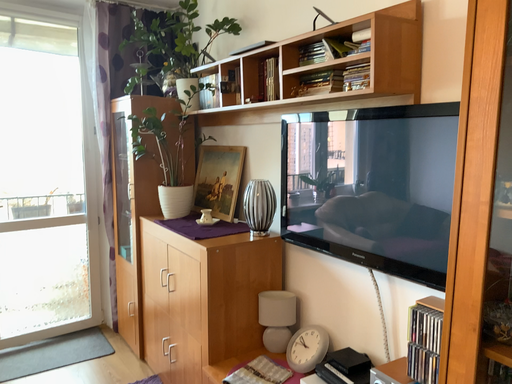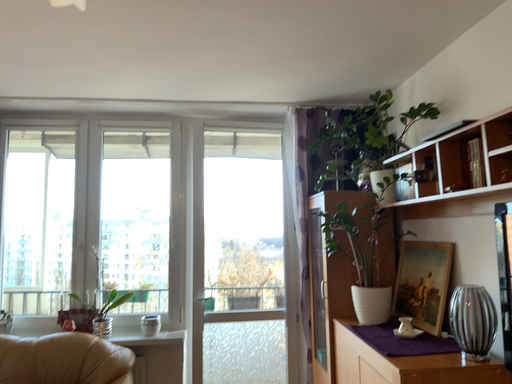
Question: How did the camera likely rotate when shooting the video?

Choices:
 (A) rotated right
 (B) rotated left

Answer: (B)